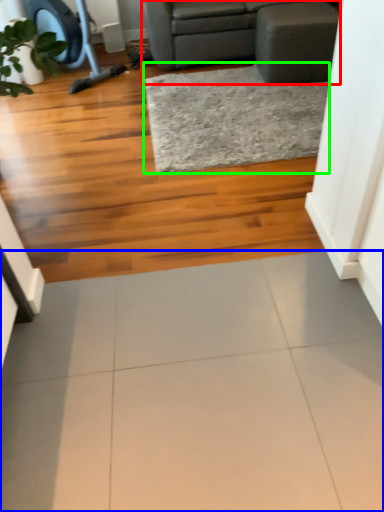
Question: Estimate the real-world distances between objects in this image. Which object is closer to studio couch (highlighted by a red box), ceramic tile (highlighted by a blue box) or mat (highlighted by a green box)?

Choices:
 (A) ceramic tile
 (B) mat

Answer: (B)